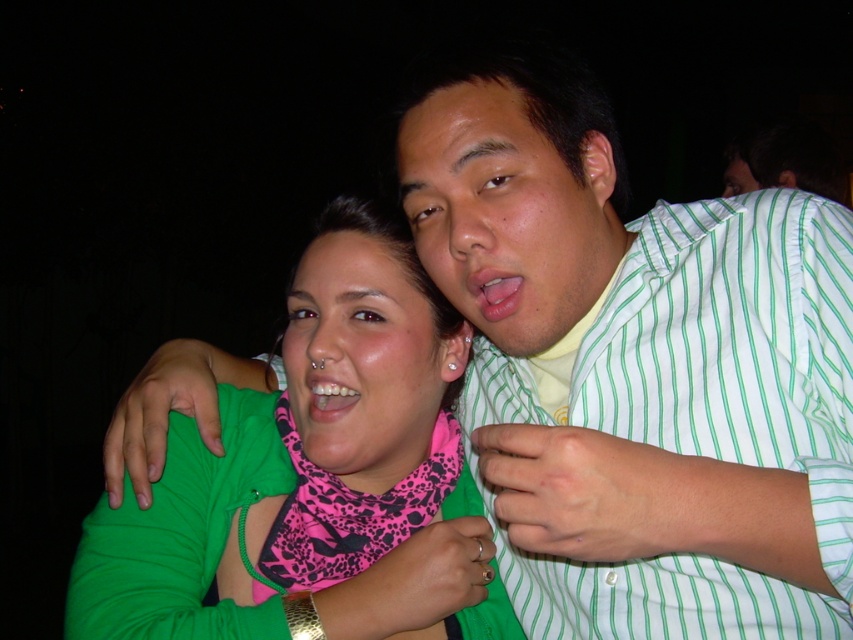
Question: Does pink leopard scarf at center come in front of white glossy teeth at center?

Choices:
 (A) yes
 (B) no

Answer: (A)

Question: Which object appears farthest from the camera in this image?

Choices:
 (A) green fabric at center
 (B) matte green shirt at center
 (C) white glossy teeth at center

Answer: (C)

Question: Based on their relative distances, which object is farther from the green fabric at center?

Choices:
 (A) matte green shirt at center
 (B) green striped shirt at upper right
 (C) pink leopard scarf at center

Answer: (B)

Question: Is the position of green fabric at center less distant than that of pink leopard scarf at center?

Choices:
 (A) no
 (B) yes

Answer: (B)

Question: Among these objects, which one is farthest from the camera?

Choices:
 (A) pink leopard scarf at center
 (B) matte green shirt at center
 (C) pink matte scarf at center
 (D) green striped shirt at upper right

Answer: (A)

Question: Is matte green shirt at center bigger than pink matte scarf at center?

Choices:
 (A) no
 (B) yes

Answer: (B)